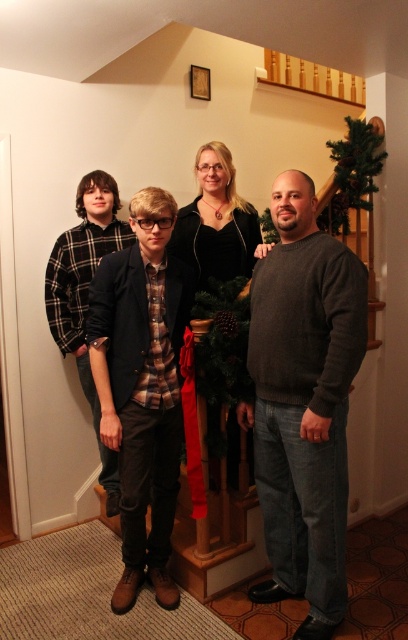
You are a photographer trying to capture a photo of the dark gray sweater at center and the dark brown leather jacket at center. Which one will appear larger in the photo?

The dark gray sweater at center will appear larger in the photo because it is closer to the viewer than the dark brown leather jacket at center.

You are standing in front of the staircase with festive decorations. There are two points marked in the image. The first point is at coordinate point (334, 531) and the second is at point (132, 528). Which point is closer to your current position?

Point (334, 531) is closer to the camera than point (132, 528), so the first point is closer to your current position.

You are a photographer trying to capture a clear photo of the flannel shirt at left without the dark brown leather jacket at center blocking it. What should you do?

Move the camera to the left side so that the flannel shirt at left becomes visible behind the dark brown leather jacket at center, since the dark brown leather jacket at center is currently in front of it.